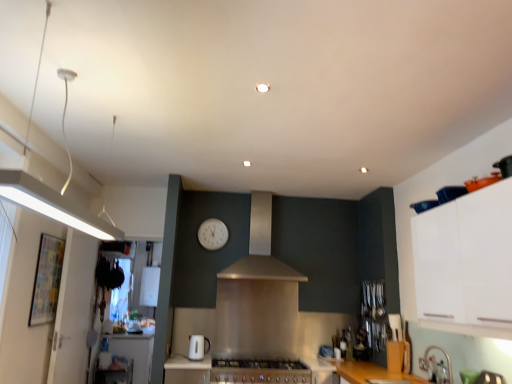
Find the location of a particular element. This screenshot has width=512, height=384. vacant space situated above white plastic clock at center (from a real-world perspective) is located at coordinates (214, 213).